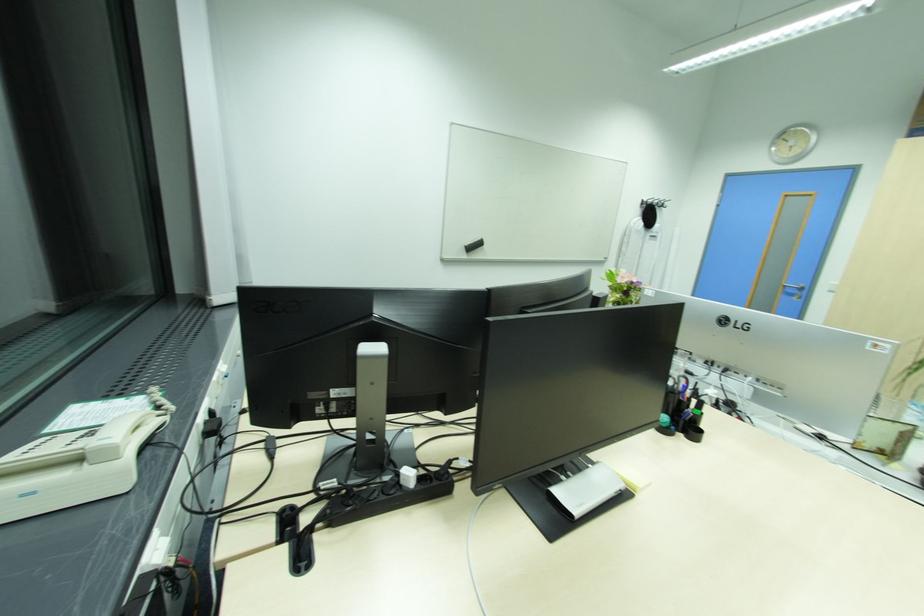
This screenshot has width=924, height=616. I want to click on silver door handle, so click(x=794, y=290).